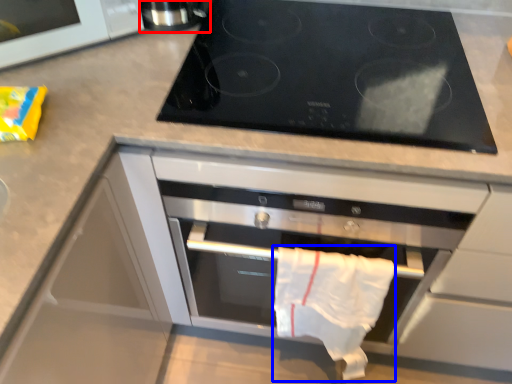
Question: Which of the following is the farthest to the observer, appliance (highlighted by a red box) or cloth (highlighted by a blue box)?

Choices:
 (A) appliance
 (B) cloth

Answer: (A)